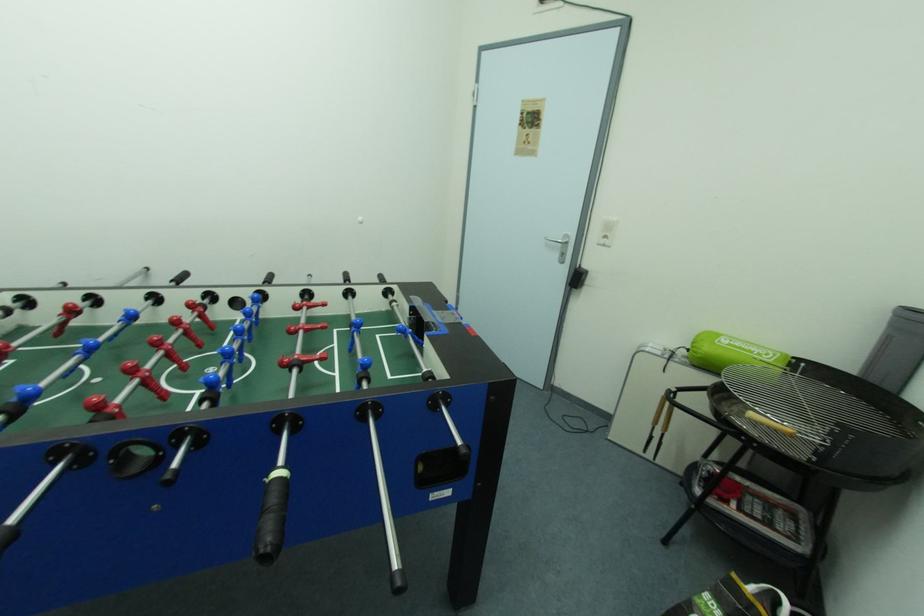
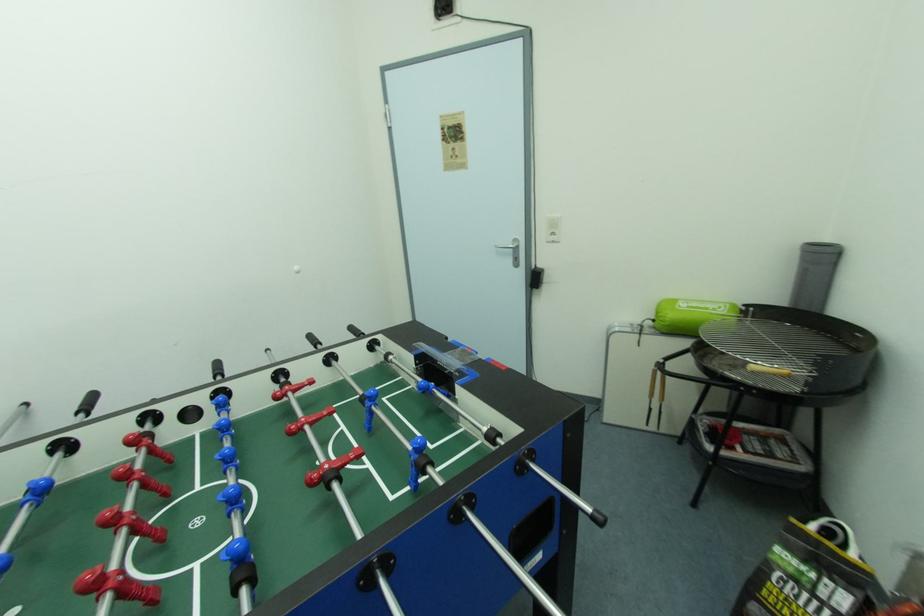
What movement of the cameraman would produce the second image?

The cameraman walked toward left, forward.